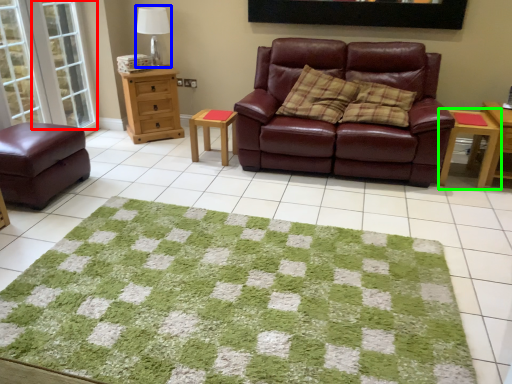
Question: Which is farther away from glass door (highlighted by a red box)? table lamp (highlighted by a blue box) or table (highlighted by a green box)?

Choices:
 (A) table lamp
 (B) table

Answer: (B)